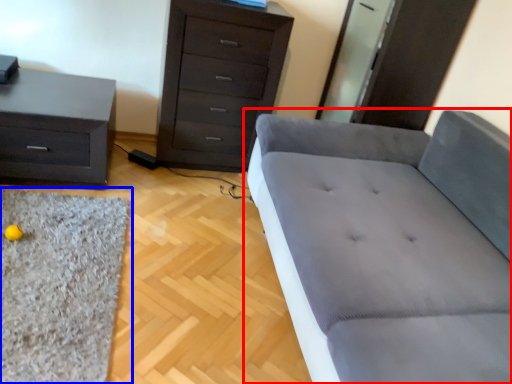
Question: Which object is closer to the camera taking this photo, studio couch (highlighted by a red box) or mat (highlighted by a blue box)?

Choices:
 (A) studio couch
 (B) mat

Answer: (A)